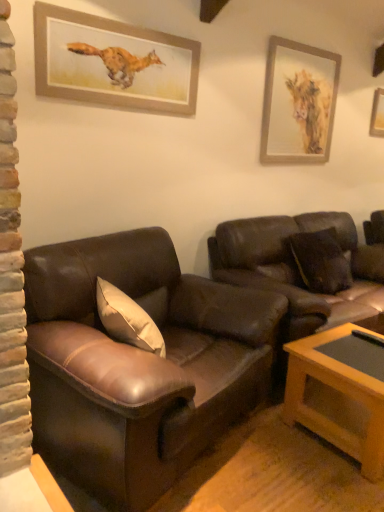
Question: Would you say wooden coffee table at lower right is a long distance from wooden picture frame at upper left, acting as the first picture frame starting from the left?

Choices:
 (A) no
 (B) yes

Answer: (B)

Question: Is wooden coffee table at lower right with wooden picture frame at upper left, acting as the first picture frame starting from the left?

Choices:
 (A) yes
 (B) no

Answer: (B)

Question: Can you confirm if wooden coffee table at lower right is shorter than wooden picture frame at upper left, which ranks as the 1th picture frame in front-to-back order?

Choices:
 (A) no
 (B) yes

Answer: (A)

Question: Is wooden coffee table at lower right oriented away from wooden picture frame at upper left, the third picture frame in the back-to-front sequence?

Choices:
 (A) no
 (B) yes

Answer: (A)

Question: Can you confirm if wooden coffee table at lower right is thinner than wooden picture frame at upper left, which ranks as the 1th picture frame in front-to-back order?

Choices:
 (A) yes
 (B) no

Answer: (B)

Question: Can you confirm if wooden coffee table at lower right is wider than wooden picture frame at upper left, the 3th picture frame in the right-to-left sequence?

Choices:
 (A) no
 (B) yes

Answer: (B)

Question: Is wooden picture frame at upper left, the 3th picture frame in the right-to-left sequence, shorter than wooden coffee table at lower right?

Choices:
 (A) no
 (B) yes

Answer: (B)

Question: Can you confirm if wooden picture frame at upper left, the 3th picture frame in the right-to-left sequence, is smaller than wooden coffee table at lower right?

Choices:
 (A) yes
 (B) no

Answer: (A)

Question: From the image's perspective, is wooden picture frame at upper left, the 3th picture frame in the right-to-left sequence, over wooden coffee table at lower right?

Choices:
 (A) no
 (B) yes

Answer: (B)

Question: Is wooden picture frame at upper left, acting as the first picture frame starting from the left, beside wooden coffee table at lower right?

Choices:
 (A) yes
 (B) no

Answer: (B)

Question: Is wooden picture frame at upper left, the 3th picture frame in the right-to-left sequence, outside wooden coffee table at lower right?

Choices:
 (A) yes
 (B) no

Answer: (A)

Question: Does wooden picture frame at upper left, acting as the first picture frame starting from the left, have a lesser width compared to wooden coffee table at lower right?

Choices:
 (A) no
 (B) yes

Answer: (B)

Question: Is wooden picture frame at upper right, the 3th picture frame in the left-to-right sequence, not within wooden picture frame at upper left, acting as the first picture frame starting from the left?

Choices:
 (A) yes
 (B) no

Answer: (A)